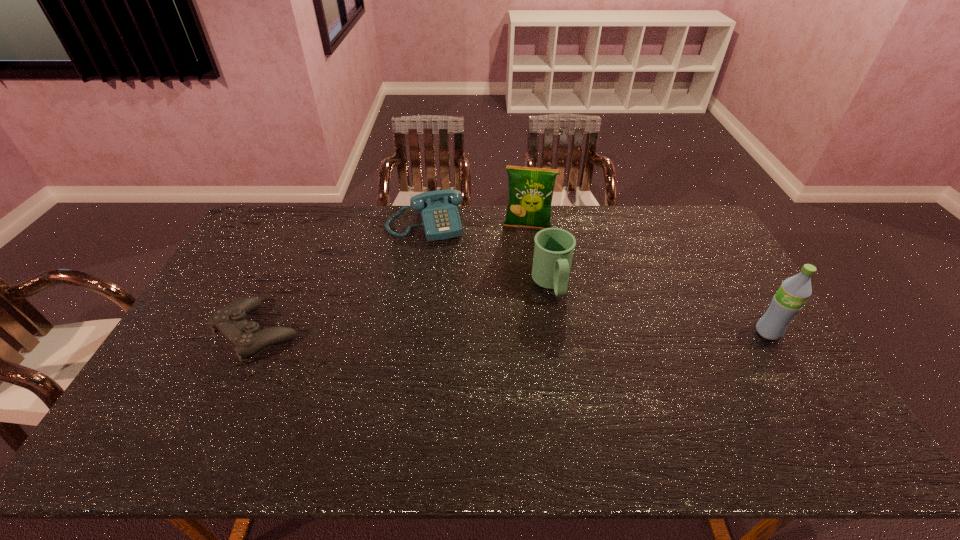
I want to click on free point between the mug and the fourth tallest object, so click(x=488, y=254).

This screenshot has height=540, width=960. Identify the location of vacant area that lies between the water bottle and the third shortest object. pos(660,308).

This screenshot has height=540, width=960. What are the coordinates of `free space between the rightmost object and the second shortest object` in the screenshot? It's located at (596, 278).

Find the location of a particular element. This screenshot has width=960, height=540. vacant space that is in between the control and the mug is located at coordinates (404, 308).

Locate an element on the screen. The width and height of the screenshot is (960, 540). object that stands as the fourth closest to the third shortest object is located at coordinates (246, 337).

Identify the location of object that is the third closest one to the rightmost object. (440, 218).

You are a GUI agent. You are given a task and a screenshot of the screen. Output one action in this format:
    pyautogui.click(x=<x>, y=<y>)
    Task: Click on the vacant space that satisfies the following two spatial constraints: 1. on the front side of the second shortest object; 2. on the left side of the crisp (potato chip)
    This screenshot has height=540, width=960.
    Given the screenshot: What is the action you would take?
    pyautogui.click(x=424, y=227)